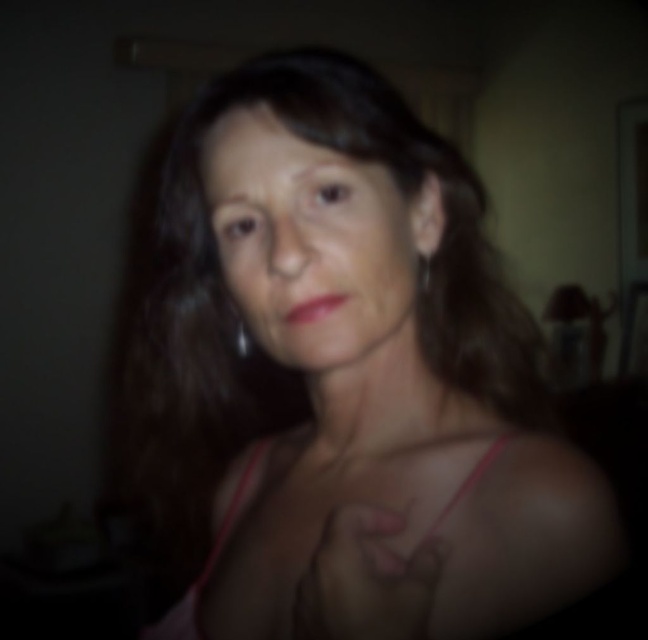
Question: Which object is closer to the camera taking this photo?

Choices:
 (A) pink fabric at center
 (B) smooth skin face at center

Answer: (A)

Question: Does pink fabric at center lie in front of silver metallic earring at upper right?

Choices:
 (A) no
 (B) yes

Answer: (B)

Question: Among these points, which one is farthest from the camera?

Choices:
 (A) (200, 164)
 (B) (244, 333)
 (C) (170, 621)

Answer: (B)

Question: Which point is farther to the camera?

Choices:
 (A) silver metallic earring at center
 (B) pink fabric dress at center

Answer: (A)

Question: Observing the image, what is the correct spatial positioning of pink fabric at center in reference to silver metallic earring at center?

Choices:
 (A) right
 (B) left

Answer: (B)

Question: Is pink fabric at center to the right of pink fabric dress at center from the viewer's perspective?

Choices:
 (A) no
 (B) yes

Answer: (A)